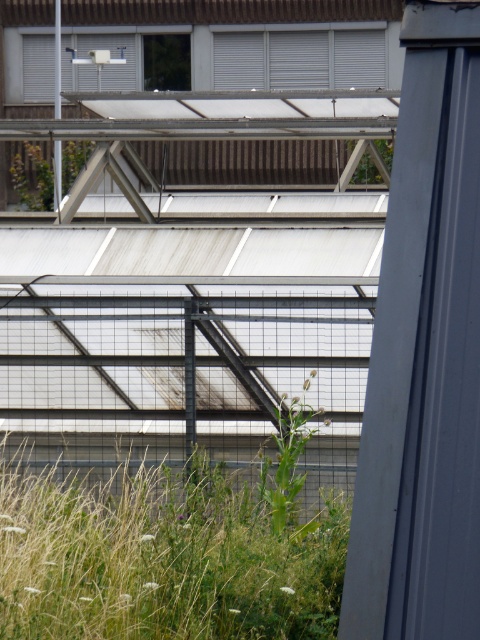
Question: Is black metal fence at center to the left of green leafy plant at lower center from the viewer's perspective?

Choices:
 (A) yes
 (B) no

Answer: (A)

Question: Which point is closer to the camera?

Choices:
 (A) (286, 339)
 (B) (244, 556)

Answer: (B)

Question: Is black metal fence at center closer to camera compared to green leafy plant at lower center?

Choices:
 (A) yes
 (B) no

Answer: (B)

Question: Does black metal fence at center appear under green leafy grass at lower left?

Choices:
 (A) yes
 (B) no

Answer: (B)

Question: Estimate the real-world distances between objects in this image. Which object is closer to the green leafy grass at lower left?

Choices:
 (A) black metal fence at center
 (B) green leafy plant at lower center

Answer: (B)

Question: Which object is closer to the camera taking this photo?

Choices:
 (A) black metal fence at center
 (B) green leafy grass at lower left

Answer: (B)